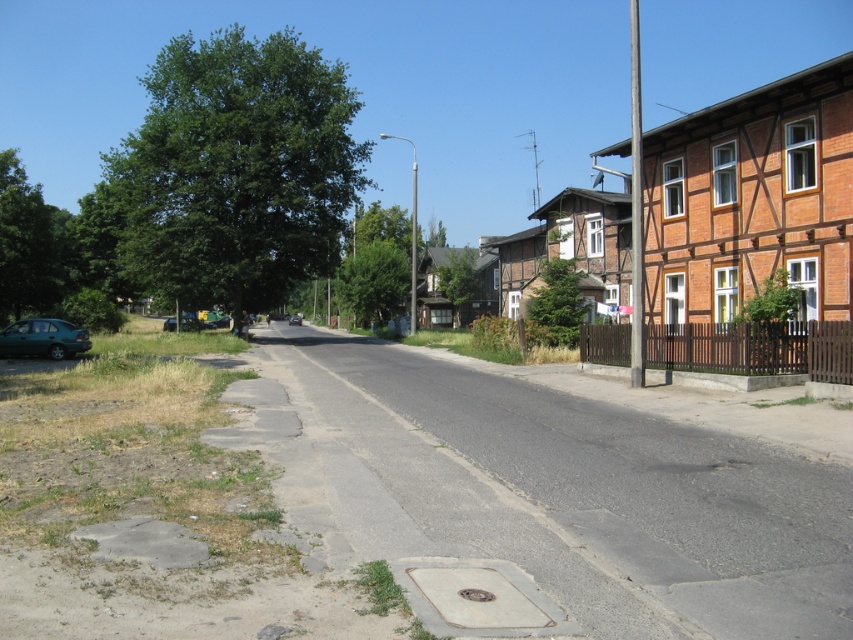
Question: Based on their relative distances, which object is nearer to the metallic pole at center?

Choices:
 (A) metallic pole at right
 (B) teal matte car at lower left

Answer: (B)

Question: Which point is farther from the camera taking this photo?

Choices:
 (A) (640, 328)
 (B) (416, 166)

Answer: (B)

Question: Observing the image, what is the correct spatial positioning of teal matte car at lower left in reference to metallic pole at center?

Choices:
 (A) right
 (B) left

Answer: (B)

Question: Does teal matte car at lower left have a smaller size compared to metallic pole at center?

Choices:
 (A) yes
 (B) no

Answer: (A)

Question: Does teal matte car at lower left lie behind shiny black car at center?

Choices:
 (A) no
 (B) yes

Answer: (A)

Question: Which object is positioned closest to the teal matte car at lower left?

Choices:
 (A) metallic pole at right
 (B) shiny black car at center
 (C) metallic pole at center

Answer: (C)